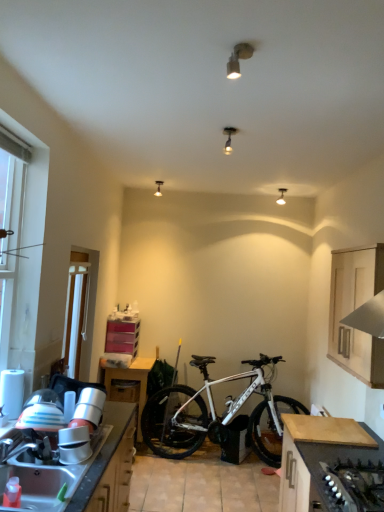
Question: Would you say metallic stainless steel sink at lower left is part of wooden drawer at lower left's contents?

Choices:
 (A) no
 (B) yes

Answer: (A)

Question: Can we say wooden drawer at lower left lies outside metallic stainless steel sink at lower left?

Choices:
 (A) no
 (B) yes

Answer: (B)

Question: Considering the relative sizes of wooden drawer at lower left and metallic stainless steel sink at lower left in the image provided, is wooden drawer at lower left thinner than metallic stainless steel sink at lower left?

Choices:
 (A) no
 (B) yes

Answer: (B)

Question: Can you confirm if wooden drawer at lower left is bigger than metallic stainless steel sink at lower left?

Choices:
 (A) no
 (B) yes

Answer: (A)

Question: Is wooden drawer at lower left positioned far away from metallic stainless steel sink at lower left?

Choices:
 (A) no
 (B) yes

Answer: (B)

Question: Based on their positions, is wooden drawer at lower left located to the left or right of metallic stainless steel sink at lower left?

Choices:
 (A) left
 (B) right

Answer: (B)

Question: In the image, is wooden drawer at lower left positioned in front of or behind metallic stainless steel sink at lower left?

Choices:
 (A) front
 (B) behind

Answer: (B)

Question: From the image's perspective, is wooden drawer at lower left above or below metallic stainless steel sink at lower left?

Choices:
 (A) above
 (B) below

Answer: (B)

Question: From a real-world perspective, is wooden drawer at lower left positioned above or below metallic stainless steel sink at lower left?

Choices:
 (A) below
 (B) above

Answer: (B)

Question: Is matte white ceiling light at upper center, positioned as the first lamp in back-to-front order, spatially inside white plastic screen door at left, or outside of it?

Choices:
 (A) inside
 (B) outside

Answer: (B)

Question: From a real-world perspective, is matte white ceiling light at upper center, acting as the first lamp starting from the left, physically located above or below white plastic screen door at left?

Choices:
 (A) above
 (B) below

Answer: (A)

Question: Is point (160, 181) positioned closer to the camera than point (62, 342)?

Choices:
 (A) closer
 (B) farther

Answer: (B)

Question: Visually, is matte white ceiling light at upper center, positioned as the 4th lamp in right-to-left order, positioned to the left or to the right of white plastic screen door at left?

Choices:
 (A) left
 (B) right

Answer: (B)

Question: Is point (72, 368) positioned closer to the camera than point (301, 493)?

Choices:
 (A) farther
 (B) closer

Answer: (A)

Question: Is white plastic screen door at left taller or shorter than dark wood countertop at lower right, which appears as the 2th cabinetry when viewed from the top?

Choices:
 (A) short
 (B) tall

Answer: (B)